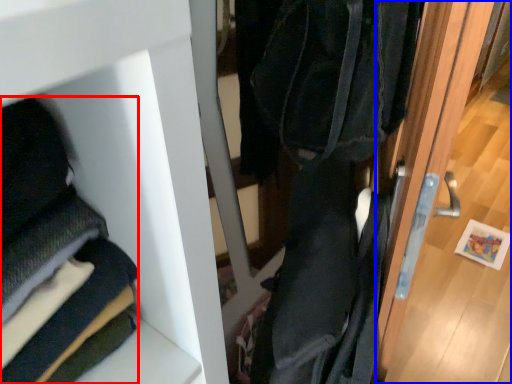
Question: Among these objects, which one is nearest to the camera, cloak (highlighted by a red box) or door (highlighted by a blue box)?

Choices:
 (A) cloak
 (B) door

Answer: (A)